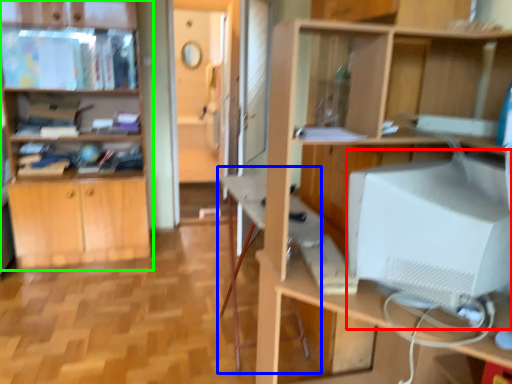
Question: Which is nearer to the computer monitor (highlighted by a red box)? computer desk (highlighted by a blue box) or cabinetry (highlighted by a green box).

Choices:
 (A) computer desk
 (B) cabinetry

Answer: (A)